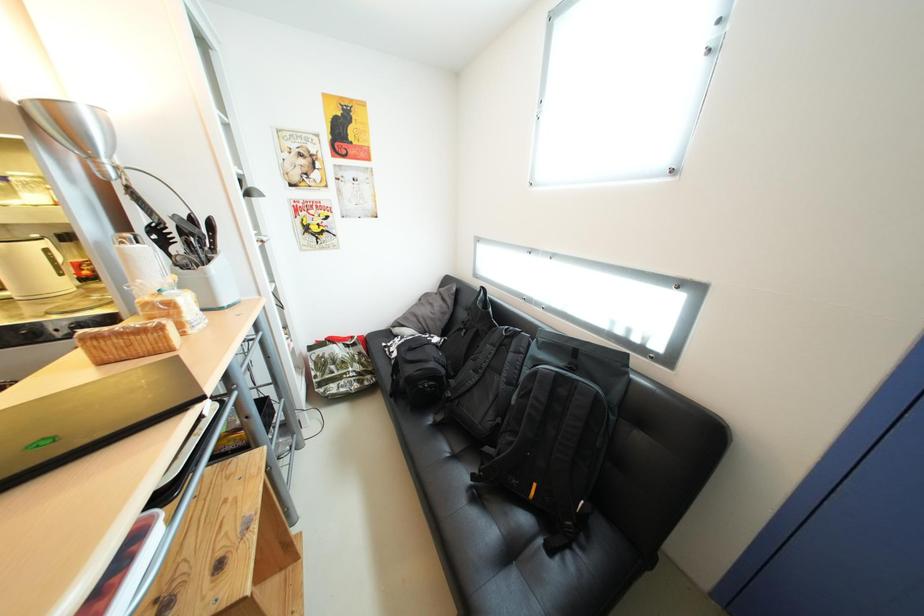
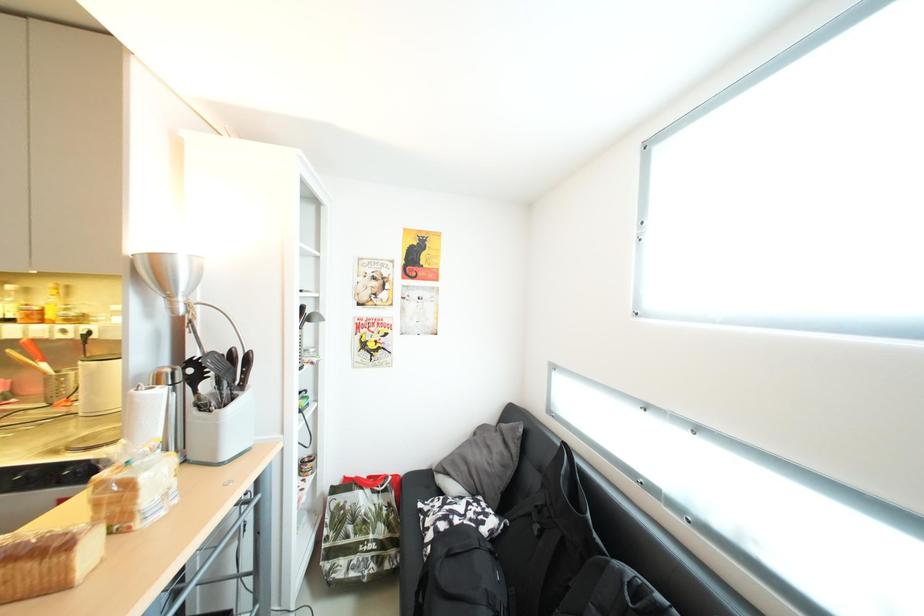
Question: The images are taken continuously from a first-person perspective. In which direction are you moving?

Choices:
 (A) Left
 (B) Right
 (C) Forward
 (D) Backward

Answer: (C)